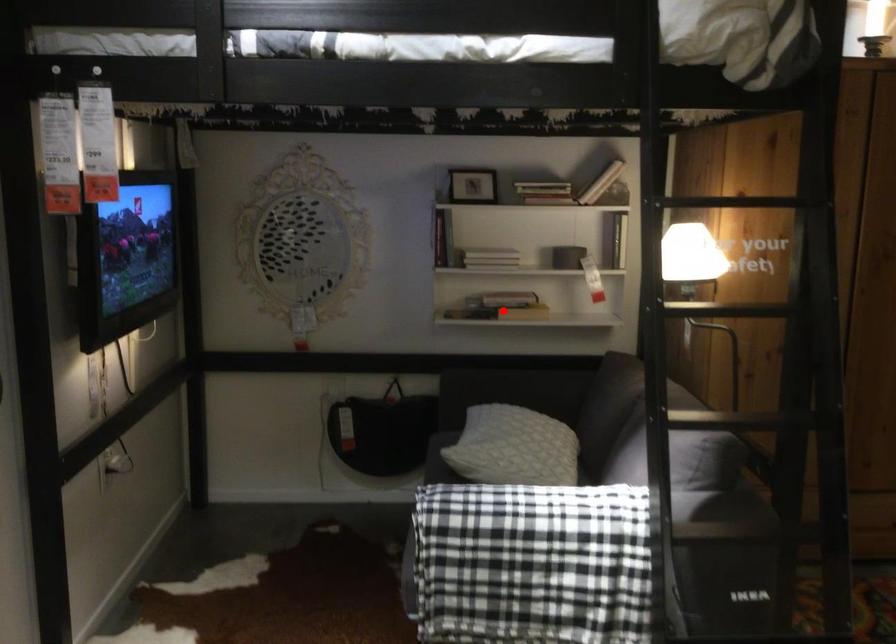
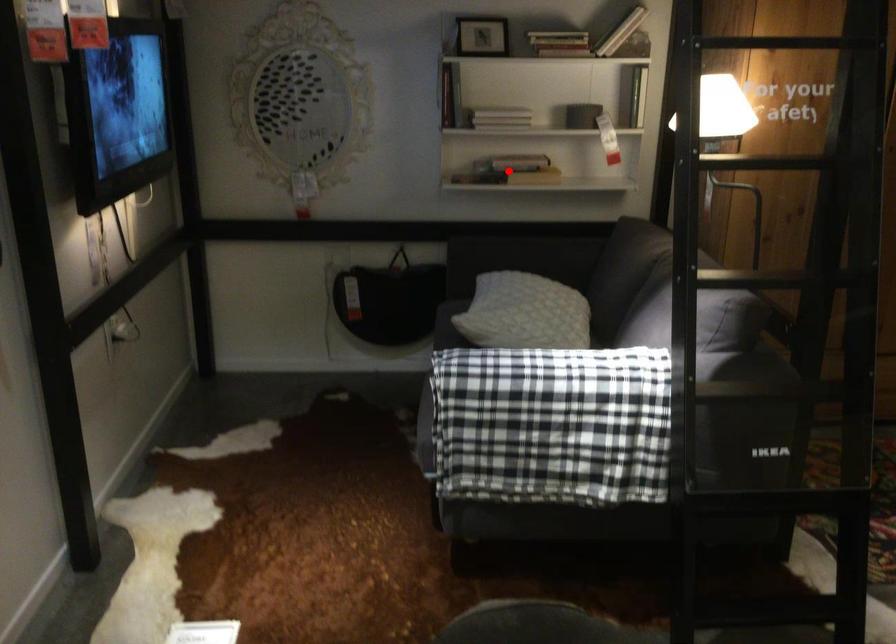
I am providing you with two images of the same scene from different viewpoints. A red point is marked on the first image and another point is marked on the second image. Is the red point in image1 aligned with the point shown in image2?

Yes